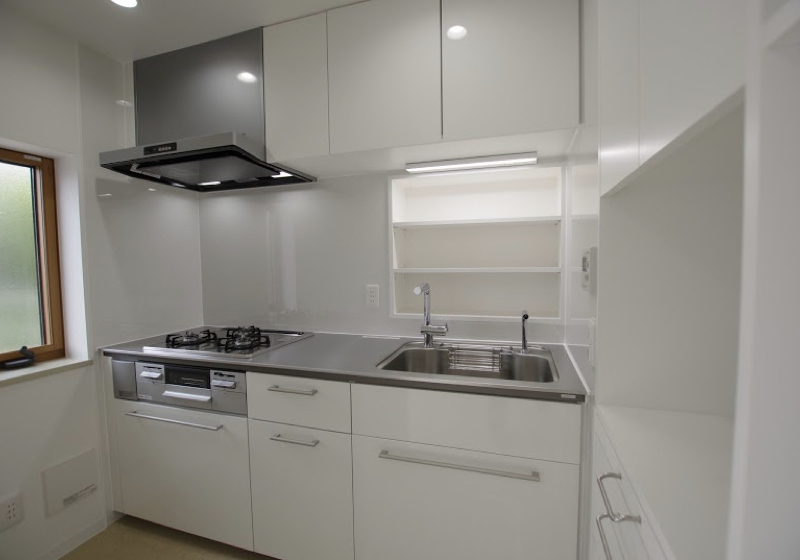
Where is `drawers`? The height and width of the screenshot is (560, 800). drawers is located at coordinates (328, 402), (632, 516).